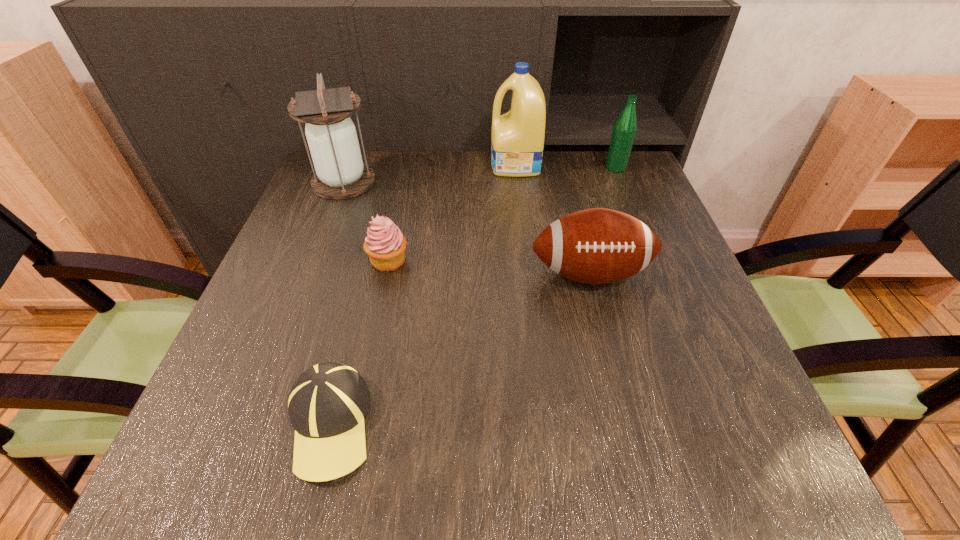
You are a GUI agent. You are given a task and a screenshot of the screen. Output one action in this format:
    pyautogui.click(x=<x>, y=<y>)
    Task: Click on the empty space between the fifth tallest object and the lantern
    
    Given the screenshot: What is the action you would take?
    pyautogui.click(x=366, y=221)

The width and height of the screenshot is (960, 540). In order to click on free spot between the lantern and the bottle in this screenshot , I will do `click(480, 175)`.

You are a GUI agent. You are given a task and a screenshot of the screen. Output one action in this format:
    pyautogui.click(x=<x>, y=<y>)
    Task: Click on the unoccupied area between the lantern and the third shortest object
    This screenshot has height=540, width=960.
    Given the screenshot: What is the action you would take?
    (x=467, y=228)

Image resolution: width=960 pixels, height=540 pixels. In order to click on free space between the cupcake and the lantern in this screenshot , I will do `click(366, 221)`.

In order to click on free area in between the lantern and the third tallest object in this screenshot , I will do [480, 175].

Find the location of a particular element. The height and width of the screenshot is (540, 960). unoccupied position between the cupcake and the lantern is located at coordinates (366, 221).

Find the location of a particular element. This screenshot has width=960, height=540. free space between the baseball cap and the fourth tallest object is located at coordinates (460, 349).

Identify the location of empty space between the cupcake and the lantern. This screenshot has height=540, width=960. pyautogui.click(x=366, y=221).

Find the location of a particular element. The width and height of the screenshot is (960, 540). empty space between the lantern and the detergent is located at coordinates (430, 173).

The height and width of the screenshot is (540, 960). Find the location of `the third closest object to the lantern`. the third closest object to the lantern is located at coordinates (596, 246).